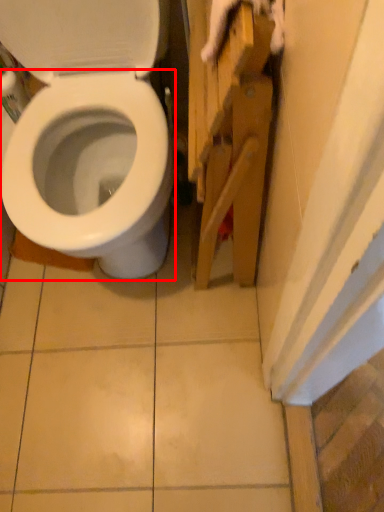
Question: From the image's perspective, what is the correct spatial relationship of bidet (annotated by the red box) in relation to cabinetry?

Choices:
 (A) above
 (B) below

Answer: (A)